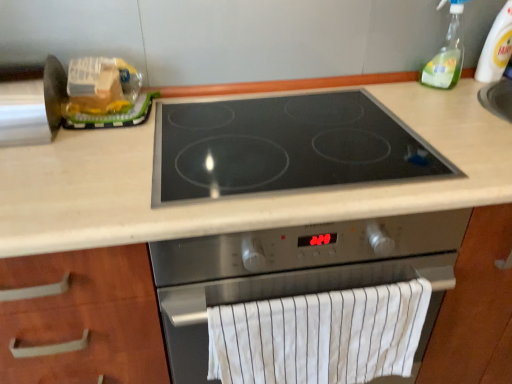
Question: Can you see translucent plastic bag at upper left touching stainless steel cooktop at center?

Choices:
 (A) yes
 (B) no

Answer: (B)

Question: Is translucent plastic bag at upper left to the left of stainless steel cooktop at center from the viewer's perspective?

Choices:
 (A) no
 (B) yes

Answer: (B)

Question: Is translucent plastic bag at upper left surrounding stainless steel cooktop at center?

Choices:
 (A) no
 (B) yes

Answer: (A)

Question: Does translucent plastic bag at upper left have a smaller size compared to stainless steel cooktop at center?

Choices:
 (A) yes
 (B) no

Answer: (A)

Question: Is translucent plastic bag at upper left not close to stainless steel cooktop at center?

Choices:
 (A) yes
 (B) no

Answer: (B)

Question: From a real-world perspective, is clear plastic bottle at upper right above or below black glass cooktop at center?

Choices:
 (A) below
 (B) above

Answer: (B)

Question: Considering the positions of point [x=483, y=77] and point [x=187, y=132], is point [x=483, y=77] closer or farther from the camera than point [x=187, y=132]?

Choices:
 (A) farther
 (B) closer

Answer: (A)

Question: Is clear plastic bottle at upper right situated inside black glass cooktop at center or outside?

Choices:
 (A) inside
 (B) outside

Answer: (B)

Question: Based on their sizes in the image, would you say clear plastic bottle at upper right is bigger or smaller than black glass cooktop at center?

Choices:
 (A) big
 (B) small

Answer: (B)

Question: Is clear plastic bottle at upper right situated inside clear plastic bottle at upper right or outside?

Choices:
 (A) inside
 (B) outside

Answer: (B)

Question: In the image, is clear plastic bottle at upper right positioned in front of or behind clear plastic bottle at upper right?

Choices:
 (A) front
 (B) behind

Answer: (A)

Question: Based on their sizes in the image, would you say clear plastic bottle at upper right is bigger or smaller than clear plastic bottle at upper right?

Choices:
 (A) small
 (B) big

Answer: (B)

Question: In the image, is clear plastic bottle at upper right on the left side or the right side of clear plastic bottle at upper right?

Choices:
 (A) left
 (B) right

Answer: (A)

Question: Based on their positions, is black glass cooktop at center located to the left or right of translucent plastic bag at upper left?

Choices:
 (A) left
 (B) right

Answer: (B)

Question: From the image's perspective, relative to translucent plastic bag at upper left, is black glass cooktop at center above or below?

Choices:
 (A) below
 (B) above

Answer: (A)